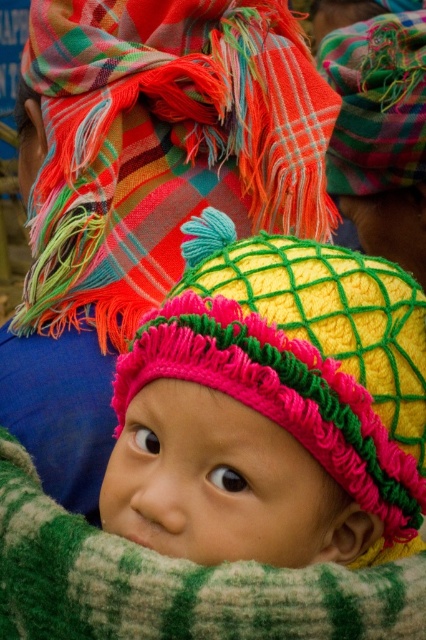
Which is in front, point (184, 445) or point (345, 608)?

Point (345, 608) is more forward.

The image size is (426, 640). I want to click on knitted yellow hat at center, so click(273, 406).

Between multicolored woven scarf at upper center and green knitted blanket at center, which one is positioned higher?

multicolored woven scarf at upper center is higher up.

Is multicolored woven scarf at upper center further to the viewer compared to green knitted blanket at center?

Yes, it is behind green knitted blanket at center.

Between point (201, 189) and point (14, 515), which one is positioned in front?

Point (14, 515) is in front.

Locate an element on the screen. This screenshot has width=426, height=640. multicolored woven scarf at upper center is located at coordinates (163, 147).

Locate an element on the screen. knitted yellow hat at center is located at coordinates tap(273, 406).

Can you confirm if knitted yellow hat at center is positioned to the right of multicolored woven scarf at upper center?

Yes, knitted yellow hat at center is to the right of multicolored woven scarf at upper center.

The height and width of the screenshot is (640, 426). What are the coordinates of `knitted yellow hat at center` in the screenshot? It's located at [x=273, y=406].

At what (x,y) coordinates should I click in order to perform the action: click on knitted yellow hat at center. Please return your answer as a coordinate pair (x, y). The width and height of the screenshot is (426, 640). Looking at the image, I should click on (273, 406).